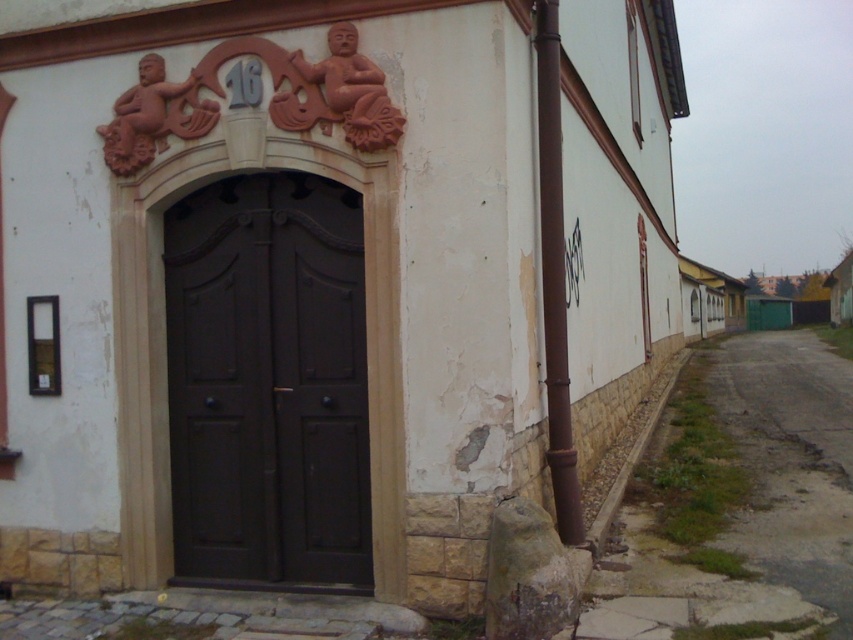
Based on the photo, is green grass at lower right behind brown metallic pipe at right?

No, green grass at lower right is closer to the viewer.

Can you confirm if green grass at lower right is smaller than brown metallic pipe at right?

No.

Is point (817, 444) positioned before point (560, 509)?

That is False.

Image resolution: width=853 pixels, height=640 pixels. I want to click on green grass at lower right, so click(738, 502).

Is matte dark brown door at center to the left of green grass at lower right from the viewer's perspective?

Yes, matte dark brown door at center is to the left of green grass at lower right.

Between matte dark brown door at center and green grass at lower right, which one has more height?

Standing taller between the two is matte dark brown door at center.

I want to click on matte dark brown door at center, so click(267, 381).

Identify the location of matte dark brown door at center. The height and width of the screenshot is (640, 853). (267, 381).

Is point (334, 444) in front of point (160, 150)?

That is True.

Can you confirm if matte dark brown door at center is positioned to the right of terracotta textured sculpture at upper center?

Indeed, matte dark brown door at center is positioned on the right side of terracotta textured sculpture at upper center.

What do you see at coordinates (267, 381) in the screenshot? I see `matte dark brown door at center` at bounding box center [267, 381].

This screenshot has width=853, height=640. What are the coordinates of `matte dark brown door at center` in the screenshot? It's located at (267, 381).